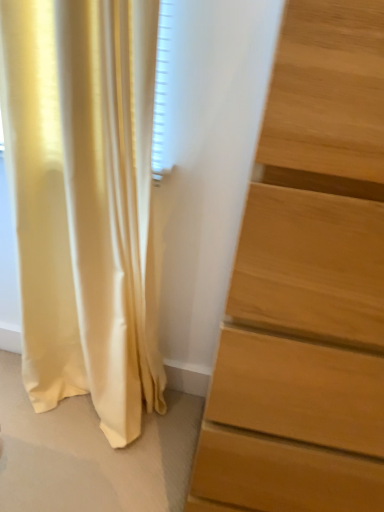
Question: Is satin yellow curtain at left to the right of light brown wooden chest of drawers at right from the viewer's perspective?

Choices:
 (A) no
 (B) yes

Answer: (A)

Question: Does satin yellow curtain at left lie behind light brown wooden chest of drawers at right?

Choices:
 (A) no
 (B) yes

Answer: (B)

Question: Would you consider satin yellow curtain at left to be distant from light brown wooden chest of drawers at right?

Choices:
 (A) yes
 (B) no

Answer: (B)

Question: From a real-world perspective, is satin yellow curtain at left positioned over light brown wooden chest of drawers at right based on gravity?

Choices:
 (A) yes
 (B) no

Answer: (B)

Question: Can you confirm if satin yellow curtain at left is shorter than light brown wooden chest of drawers at right?

Choices:
 (A) no
 (B) yes

Answer: (B)

Question: Does satin yellow curtain at left lie in front of light brown wooden chest of drawers at right?

Choices:
 (A) no
 (B) yes

Answer: (A)

Question: Does light brown wooden chest of drawers at right touch satin yellow curtain at left?

Choices:
 (A) yes
 (B) no

Answer: (B)

Question: From a real-world perspective, is light brown wooden chest of drawers at right located higher than satin yellow curtain at left?

Choices:
 (A) no
 (B) yes

Answer: (B)

Question: From a real-world perspective, is light brown wooden chest of drawers at right physically below satin yellow curtain at left?

Choices:
 (A) yes
 (B) no

Answer: (B)

Question: Is light brown wooden chest of drawers at right positioned in front of satin yellow curtain at left?

Choices:
 (A) yes
 (B) no

Answer: (A)

Question: Is light brown wooden chest of drawers at right positioned behind satin yellow curtain at left?

Choices:
 (A) yes
 (B) no

Answer: (B)

Question: Is light brown wooden chest of drawers at right far from satin yellow curtain at left?

Choices:
 (A) no
 (B) yes

Answer: (A)

Question: Is satin yellow curtain at left wider or thinner than light brown wooden chest of drawers at right?

Choices:
 (A) thin
 (B) wide

Answer: (A)